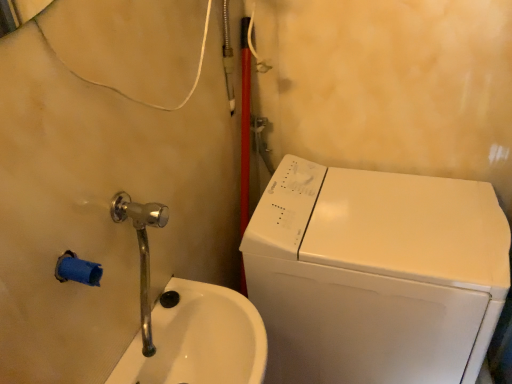
Question: Is white glossy sink at lower left not close to polished chrome faucet at lower left?

Choices:
 (A) no
 (B) yes

Answer: (A)

Question: From a real-world perspective, is white glossy sink at lower left on polished chrome faucet at lower left?

Choices:
 (A) yes
 (B) no

Answer: (B)

Question: Is white glossy sink at lower left thinner than polished chrome faucet at lower left?

Choices:
 (A) yes
 (B) no

Answer: (B)

Question: Is white glossy sink at lower left oriented towards polished chrome faucet at lower left?

Choices:
 (A) no
 (B) yes

Answer: (A)

Question: Is white glossy sink at lower left positioned behind polished chrome faucet at lower left?

Choices:
 (A) yes
 (B) no

Answer: (A)

Question: Is white glossy washing machine at right taller or shorter than white glossy sink at lower left?

Choices:
 (A) short
 (B) tall

Answer: (B)

Question: Does point tap(276, 190) appear closer or farther from the camera than point tap(132, 357)?

Choices:
 (A) farther
 (B) closer

Answer: (A)

Question: From a real-world perspective, is white glossy washing machine at right above or below white glossy sink at lower left?

Choices:
 (A) above
 (B) below

Answer: (B)

Question: Which is correct: white glossy washing machine at right is inside white glossy sink at lower left, or outside of it?

Choices:
 (A) inside
 (B) outside

Answer: (B)

Question: Considering the positions of white glossy sink at lower left and polished chrome faucet at lower left in the image, is white glossy sink at lower left bigger or smaller than polished chrome faucet at lower left?

Choices:
 (A) big
 (B) small

Answer: (A)

Question: Would you say white glossy sink at lower left is to the left or to the right of polished chrome faucet at lower left in the picture?

Choices:
 (A) left
 (B) right

Answer: (B)

Question: Which is correct: white glossy sink at lower left is inside polished chrome faucet at lower left, or outside of it?

Choices:
 (A) outside
 (B) inside

Answer: (A)

Question: Is white glossy sink at lower left in front of or behind polished chrome faucet at lower left in the image?

Choices:
 (A) behind
 (B) front

Answer: (A)

Question: Considering the positions of polished chrome faucet at lower left and white glossy washing machine at right in the image, is polished chrome faucet at lower left taller or shorter than white glossy washing machine at right?

Choices:
 (A) short
 (B) tall

Answer: (A)

Question: Is polished chrome faucet at lower left spatially inside white glossy washing machine at right, or outside of it?

Choices:
 (A) inside
 (B) outside

Answer: (B)